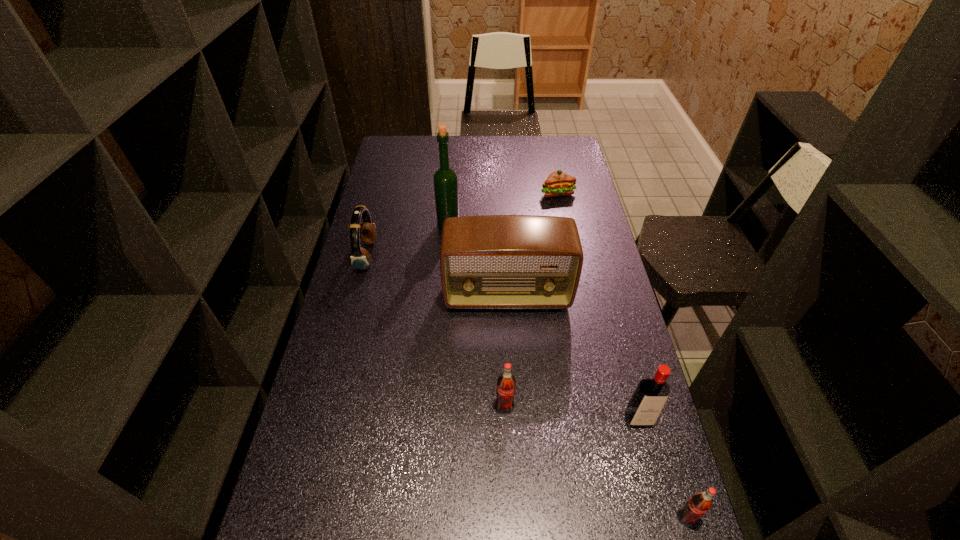
The width and height of the screenshot is (960, 540). I want to click on soda bottle positioned at the right edge, so click(696, 506).

Identify the location of radio receiver that is positioned at the right edge. (491, 261).

Identify the location of sandwich that is at the right edge. The width and height of the screenshot is (960, 540). (558, 183).

Identify the location of vodka that is at the right edge. This screenshot has height=540, width=960. [651, 394].

This screenshot has height=540, width=960. I want to click on object present at the near right corner, so click(696, 506).

What are the coordinates of `free space at the far edge of the desktop` in the screenshot? It's located at click(423, 160).

This screenshot has height=540, width=960. In order to click on vacant space at the left edge of the desktop in this screenshot , I will do `click(398, 201)`.

The height and width of the screenshot is (540, 960). Find the location of `free space at the right edge of the desktop`. free space at the right edge of the desktop is located at coordinates (578, 172).

The height and width of the screenshot is (540, 960). In order to click on free location at the far right corner of the desktop in this screenshot , I will do `click(551, 148)`.

This screenshot has height=540, width=960. Identify the location of vacant space in between the sixth nearest object and the shortest object. (503, 209).